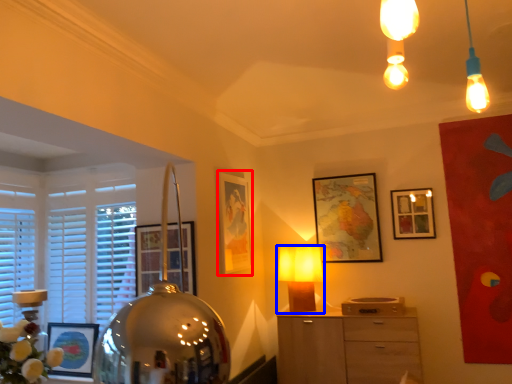
Question: Which of the following is the closest to the observer, picture frame (highlighted by a red box) or lamp (highlighted by a blue box)?

Choices:
 (A) picture frame
 (B) lamp

Answer: (A)